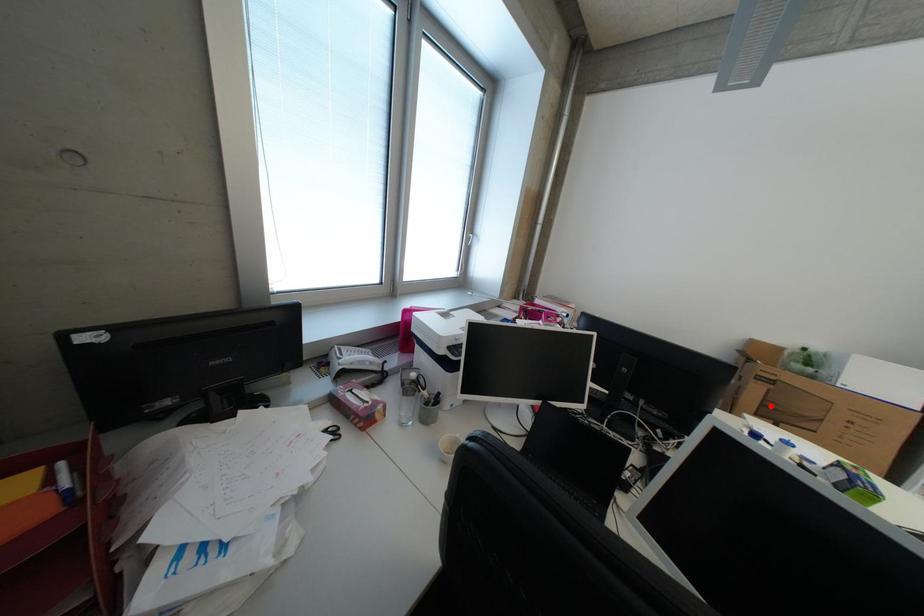
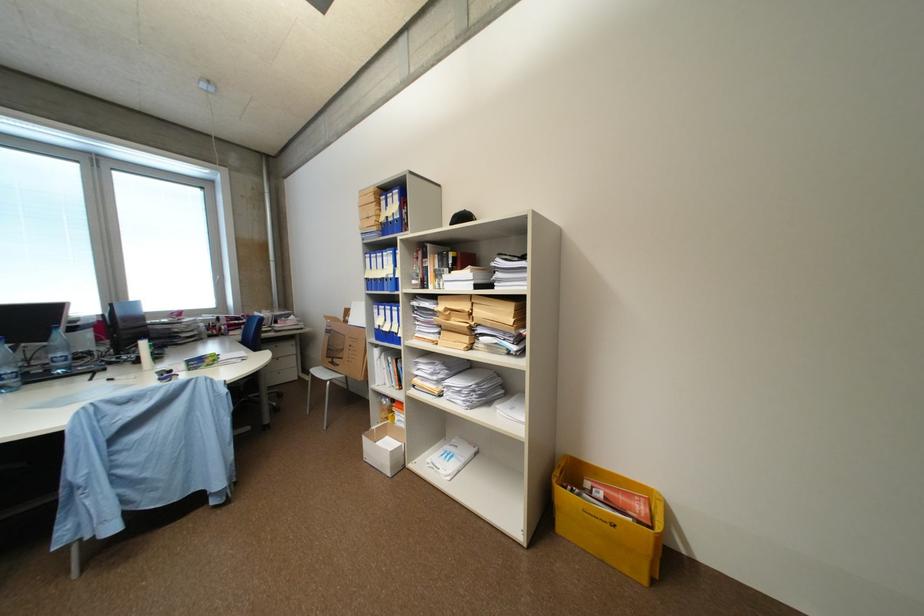
Where in the second image is the point corresponding to the highlighted location from the first image?

(336, 350)